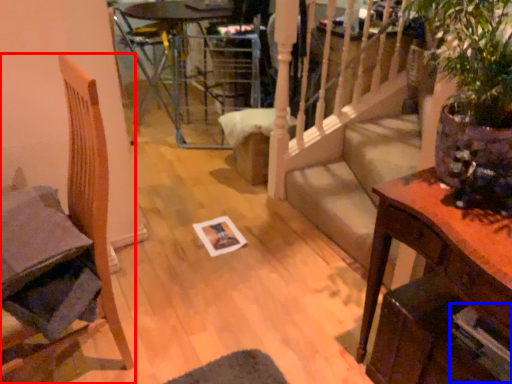
Question: Among these objects, which one is farthest to the camera, chair (highlighted by a red box) or magazine (highlighted by a blue box)?

Choices:
 (A) chair
 (B) magazine

Answer: (B)